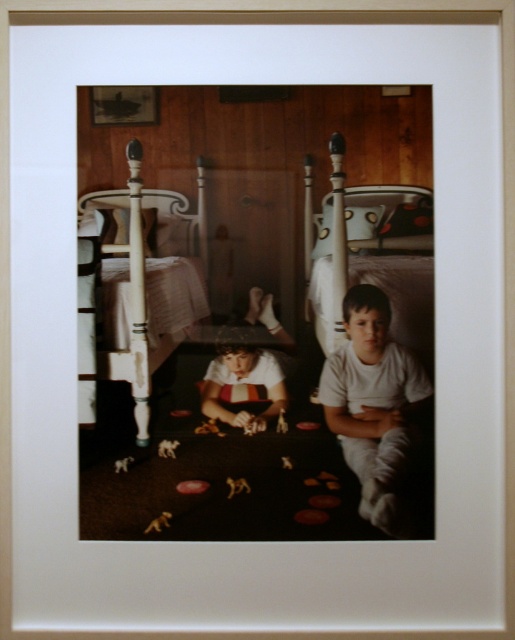
Who is positioned more to the right, white wood bed at upper center or white cotton shirt at center?

From the viewer's perspective, white cotton shirt at center appears more on the right side.

Is white wood bed at upper center positioned at the back of white cotton shirt at center?

Yes, it is.

I want to click on white wood bed at upper center, so click(x=373, y=257).

The image size is (515, 640). What are the coordinates of `white wood bed at upper center` in the screenshot? It's located at (373, 257).

Is white wood bed at upper center taller than striped t-shirt at center?

Yes, white wood bed at upper center is taller than striped t-shirt at center.

Is white wood bed at upper center bigger than striped t-shirt at center?

Yes.

What do you see at coordinates (373, 257) in the screenshot? This screenshot has height=640, width=515. I see `white wood bed at upper center` at bounding box center [373, 257].

Identify the location of white wood bed at upper center. The image size is (515, 640). (373, 257).

Consider the image. Between white painted wood bed at left and white wood bed at upper center, which one appears on the left side from the viewer's perspective?

white painted wood bed at left is more to the left.

Is white painted wood bed at left shorter than white wood bed at upper center?

Incorrect, white painted wood bed at left's height does not fall short of white wood bed at upper center's.

Is point (90, 358) in front of point (369, 228)?

That is True.

I want to click on white painted wood bed at left, so click(140, 289).